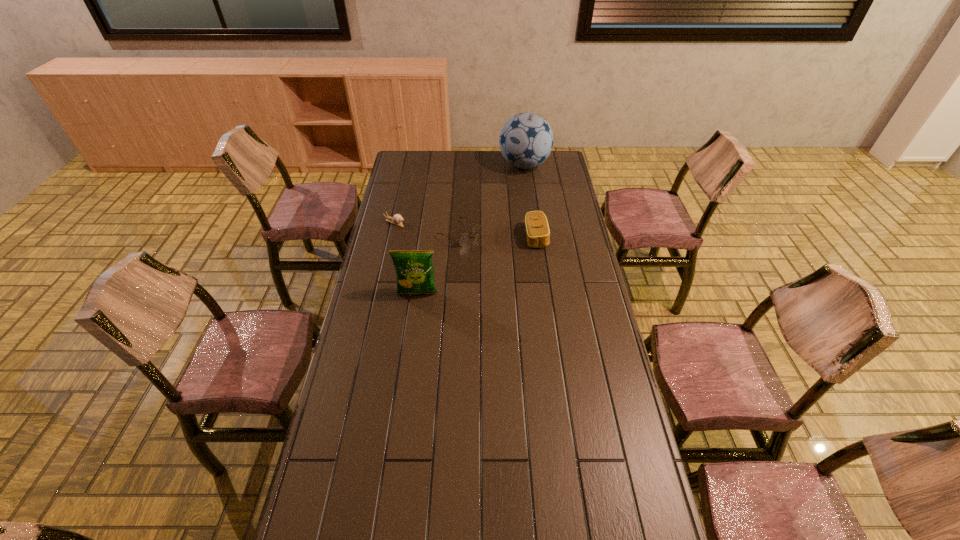
Where is `free location located 0.220m on the lenses of the sunglasses`? The width and height of the screenshot is (960, 540). free location located 0.220m on the lenses of the sunglasses is located at coordinates (516, 266).

In order to click on free location located 0.300m on the lenses of the sunglasses in this screenshot , I will do `click(532, 275)`.

Locate an element on the screen. The width and height of the screenshot is (960, 540). free spot located 0.110m on the lenses of the sunglasses is located at coordinates (495, 254).

The height and width of the screenshot is (540, 960). Find the location of `vacant space situated 0.330m on the side with brand of the tallest object`. vacant space situated 0.330m on the side with brand of the tallest object is located at coordinates (497, 215).

You are a GUI agent. You are given a task and a screenshot of the screen. Output one action in this format:
    pyautogui.click(x=<x>, y=<y>)
    Task: Click on the free region located on the side with brand of the tallest object
    This screenshot has width=960, height=540.
    Given the screenshot: What is the action you would take?
    pyautogui.click(x=509, y=194)

Locate an element on the screen. This screenshot has width=960, height=540. vacant space located 0.090m on the side with brand of the tallest object is located at coordinates (512, 188).

The height and width of the screenshot is (540, 960). Identify the location of free point located on the shell of the shortest object. (444, 240).

Find the location of a particular element. The height and width of the screenshot is (540, 960). vacant region located 0.260m on the shell of the shortest object is located at coordinates point(452,244).

The image size is (960, 540). I want to click on vacant point located 0.380m on the shell of the shortest object, so click(476, 253).

Where is `object at the far edge`? The height and width of the screenshot is (540, 960). object at the far edge is located at coordinates (526, 140).